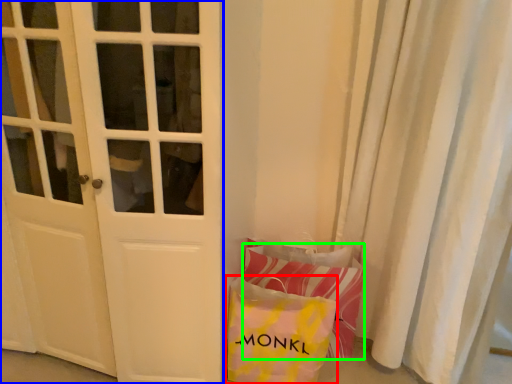
Question: Which object is positioned farthest from pouch (highlighted by a red box)? Select from door (highlighted by a blue box) and pillow (highlighted by a green box).

Choices:
 (A) door
 (B) pillow

Answer: (A)